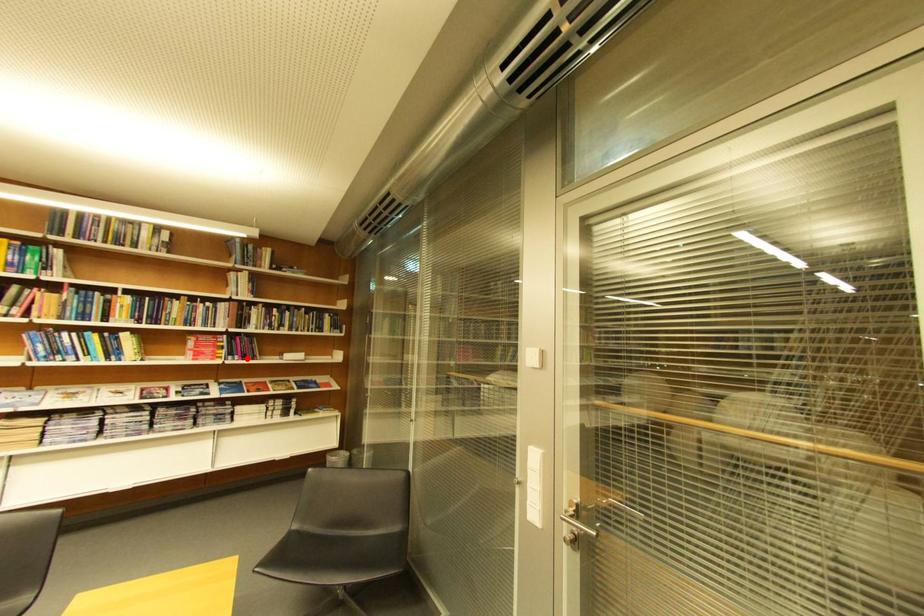
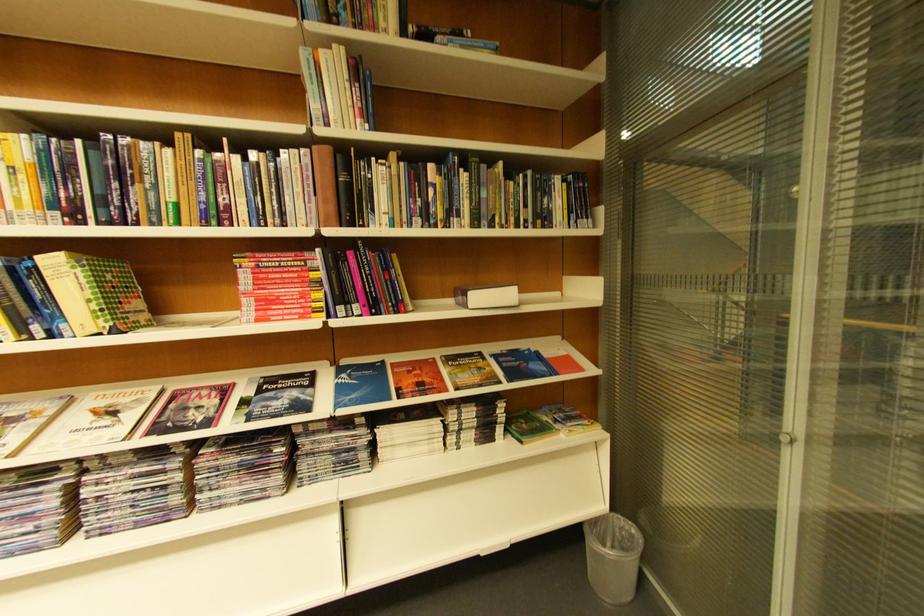
Find the pixel in the second image that matches the highlighted location in the first image.

(367, 310)